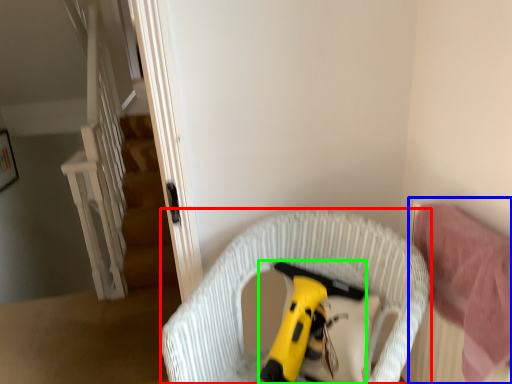
Question: Based on their relative distances, which object is nearer to furniture (highlighted by a red box)? Choose from bed (highlighted by a blue box) and toy (highlighted by a green box).

Choices:
 (A) bed
 (B) toy

Answer: (B)